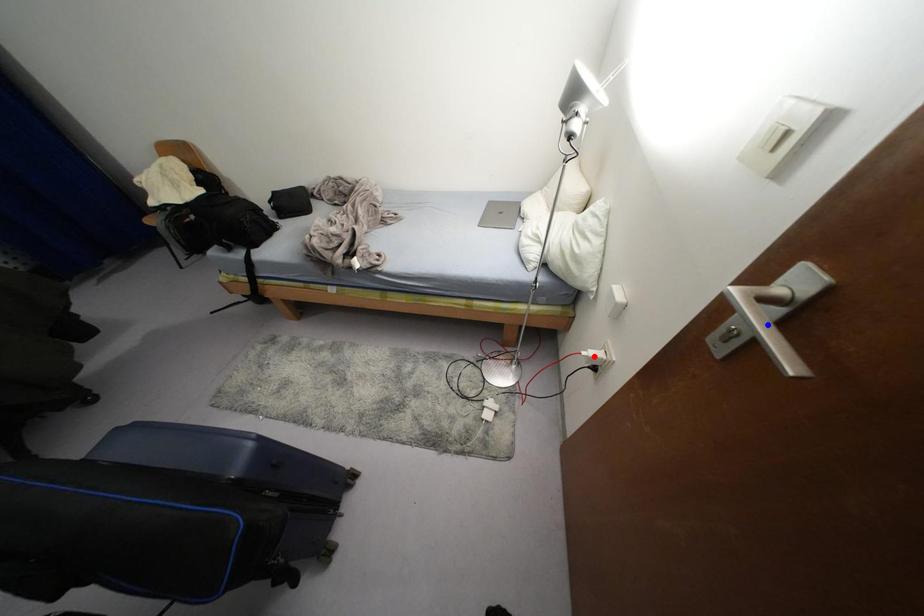
Question: In the image, two points are highlighted. Which point is nearer to the camera? Reply with the corresponding letter.

Choices:
 (A) blue point
 (B) red point

Answer: (A)